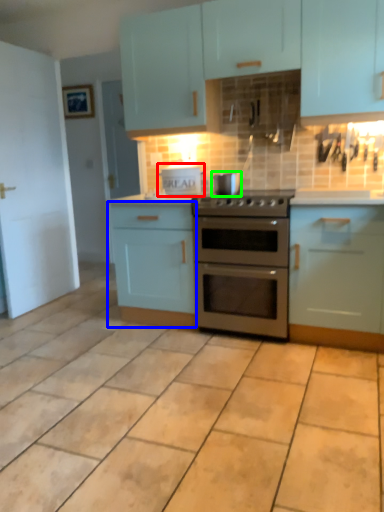
Question: Which object is the farthest from appliance (highlighted by a red box)? Choose among these: cabinetry (highlighted by a blue box) or appliance (highlighted by a green box).

Choices:
 (A) cabinetry
 (B) appliance

Answer: (A)